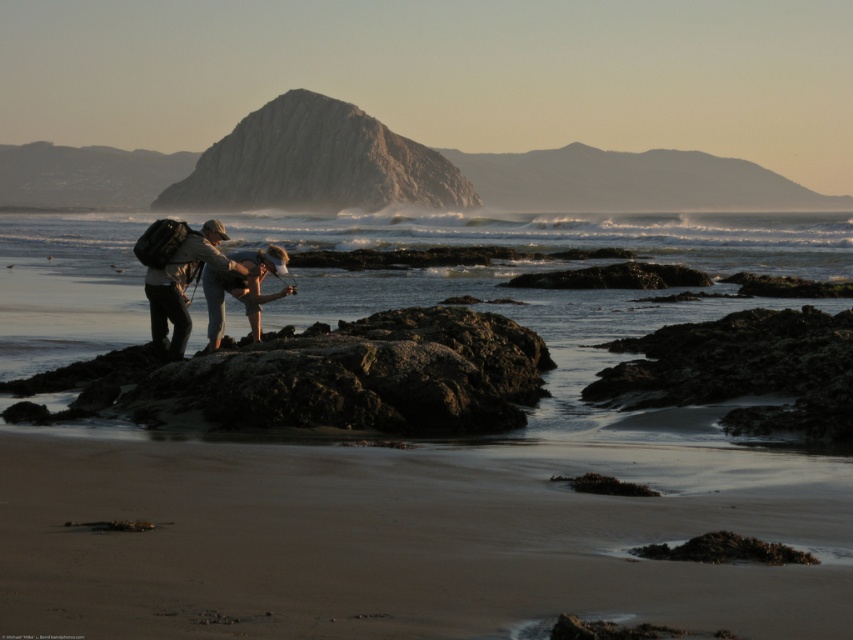
Question: Can you confirm if matte khaki pants at center is positioned to the left of matte khaki shorts at center?

Choices:
 (A) no
 (B) yes

Answer: (B)

Question: Based on their relative distances, which object is farther from the smooth sand beach at center?

Choices:
 (A) matte khaki shorts at center
 (B) rugged granite rock at center

Answer: (B)

Question: Among these points, which one is farthest from the camera?

Choices:
 (A) (383, 586)
 (B) (286, 182)
 (C) (252, 280)
 (D) (178, 356)

Answer: (B)

Question: Can you confirm if smooth sand beach at center is positioned above rugged granite rock at center?

Choices:
 (A) yes
 (B) no

Answer: (B)

Question: Can you confirm if rugged granite rock at center is wider than matte khaki shorts at center?

Choices:
 (A) yes
 (B) no

Answer: (A)

Question: Based on their relative distances, which object is nearer to the smooth sand beach at center?

Choices:
 (A) matte khaki pants at center
 (B) rugged granite rock at center
 (C) matte khaki shorts at center

Answer: (A)